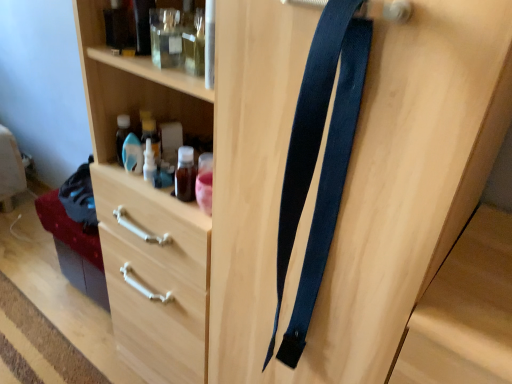
Question: From their relative heights in the image, would you say transparent plastic bottle at upper center is taller or shorter than wooden drawer at lower left?

Choices:
 (A) short
 (B) tall

Answer: (B)

Question: Is transparent plastic bottle at upper center in front of or behind wooden drawer at lower left in the image?

Choices:
 (A) behind
 (B) front

Answer: (B)

Question: Estimate the real-world distances between objects in this image. Which object is farther from the transparent plastic bottle at upper center?

Choices:
 (A) wooden drawer at lower left
 (B) dark blue fabric suspenders at center

Answer: (B)

Question: Which of these objects is positioned closest to the transparent plastic bottle at upper center?

Choices:
 (A) dark blue fabric suspenders at center
 (B) wooden drawer at lower left

Answer: (B)